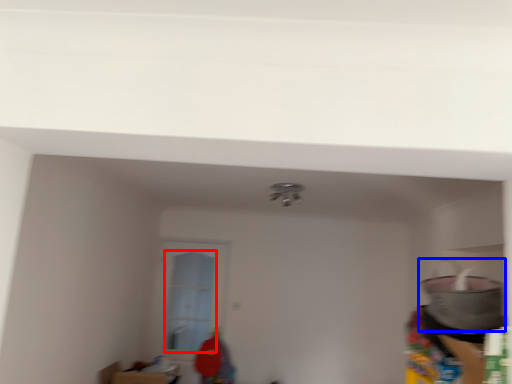
Question: Among these objects, which one is farthest to the camera, glass door (highlighted by a red box) or appliance (highlighted by a blue box)?

Choices:
 (A) glass door
 (B) appliance

Answer: (A)